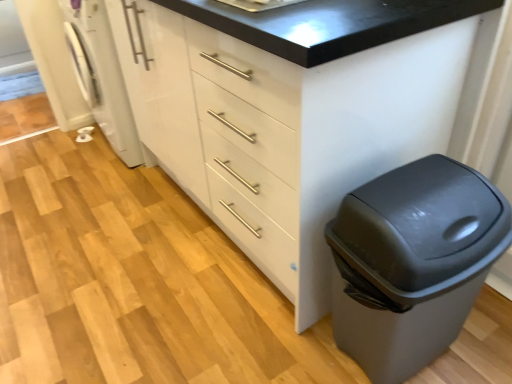
You are a GUI agent. You are given a task and a screenshot of the screen. Output one action in this format:
    pyautogui.click(x=<x>, y=<y>)
    Task: Click on the blank space above matte gray trash can at lower right (from a real-world perspective)
    The height and width of the screenshot is (384, 512).
    Given the screenshot: What is the action you would take?
    pyautogui.click(x=414, y=192)